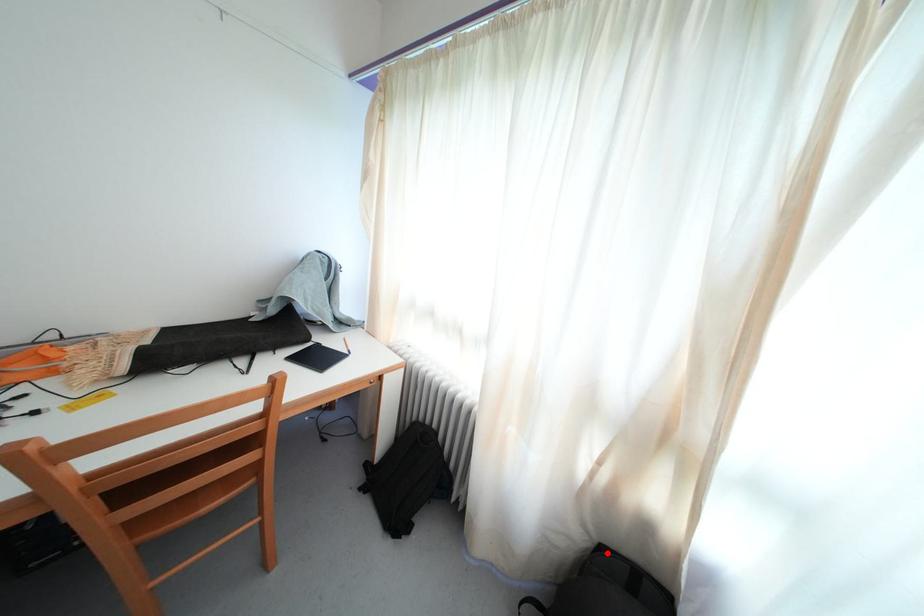
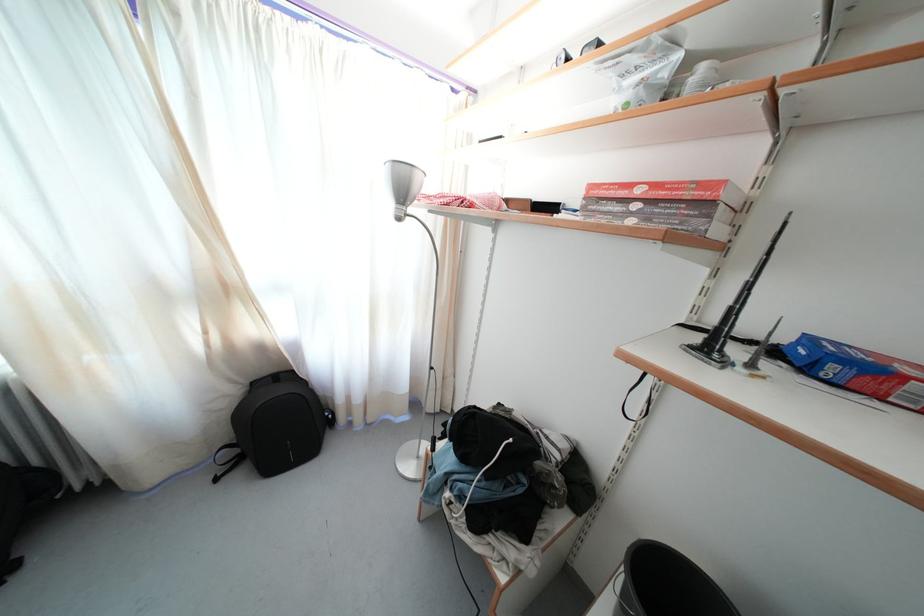
Find the pixel in the second image that matches the highlighted location in the first image.

(259, 390)